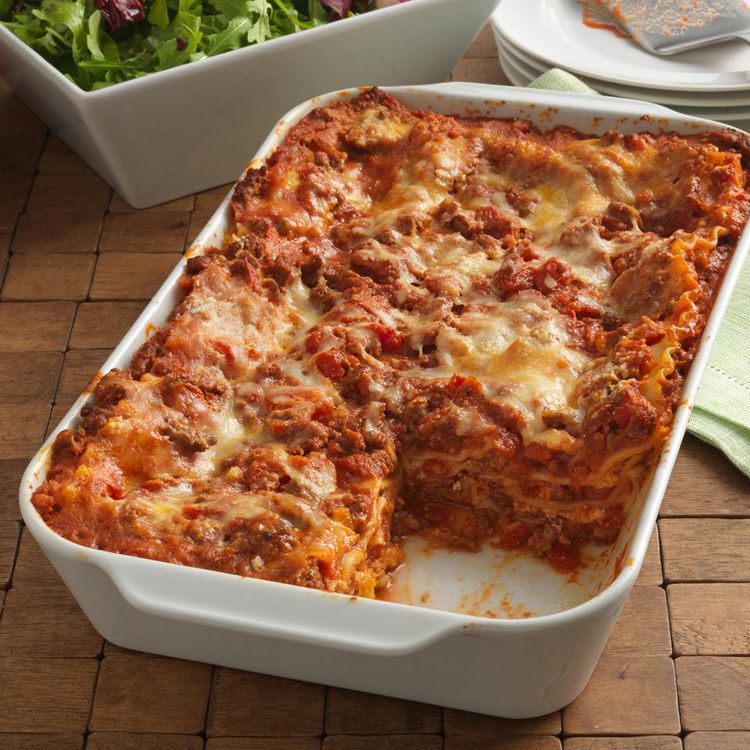
This screenshot has width=750, height=750. Identify the location of bowl. pos(184,115).